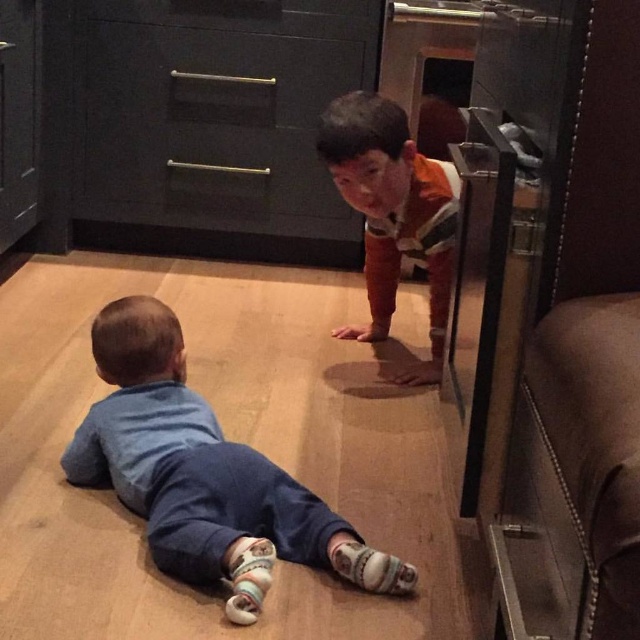
Looking at this image, does blue soft fabric toddler at lower left appear over orange striped shirt at center?

Actually, blue soft fabric toddler at lower left is below orange striped shirt at center.

What do you see at coordinates (204, 474) in the screenshot?
I see `blue soft fabric toddler at lower left` at bounding box center [204, 474].

Between point (147, 316) and point (324, 154), which one is positioned in front?

Point (147, 316) is in front.

The height and width of the screenshot is (640, 640). Identify the location of blue soft fabric toddler at lower left. (204, 474).

Between matte black drawer at upper center and orange striped shirt at center, which one has less height?

orange striped shirt at center

Which is behind, point (80, 141) or point (346, 189)?

Positioned behind is point (80, 141).

This screenshot has width=640, height=640. In order to click on matte black drawer at upper center in this screenshot , I will do `click(218, 112)`.

Does matte black drawer at upper center appear on the right side of blue soft fabric toddler at lower left?

No, matte black drawer at upper center is not to the right of blue soft fabric toddler at lower left.

The image size is (640, 640). I want to click on matte black drawer at upper center, so click(218, 112).

What do you see at coordinates (218, 112) in the screenshot?
I see `matte black drawer at upper center` at bounding box center [218, 112].

Find the location of `matte black drawer at upper center`. matte black drawer at upper center is located at coordinates (218, 112).